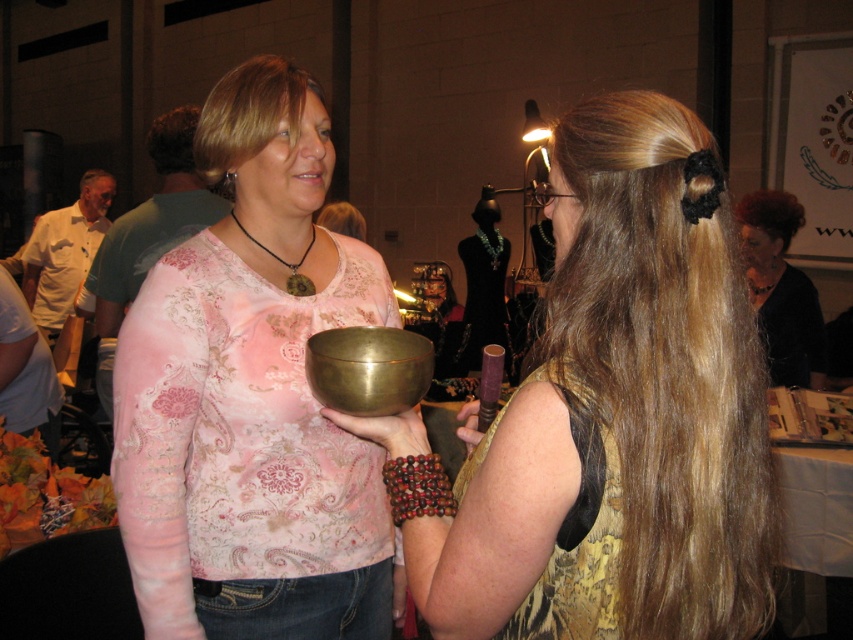
Question: Considering the real-world distances, which object is farthest from the metallic gold bowl at center?

Choices:
 (A) brown fuzzy hair at upper left
 (B) brass/yellow metal bowl at center
 (C) dark brown hair at upper left

Answer: (C)

Question: Is gold metallic bowl at center wider than shiny black hair at upper right?

Choices:
 (A) yes
 (B) no

Answer: (A)

Question: Is brown fuzzy hair at upper left below dark red hair at upper right?

Choices:
 (A) no
 (B) yes

Answer: (A)

Question: Can you confirm if gold metallic bowl at center is positioned above brass/yellow metal bowl at center?

Choices:
 (A) yes
 (B) no

Answer: (A)

Question: Which point is farther from the camera taking this photo?

Choices:
 (A) (791, 348)
 (B) (184, 116)

Answer: (A)

Question: Which of the following is the closest to the observer?

Choices:
 (A) blonde hair at upper center
 (B) metallic gold bowl at center
 (C) dark brown hair at upper left
 (D) shiny black hair at upper right

Answer: (B)